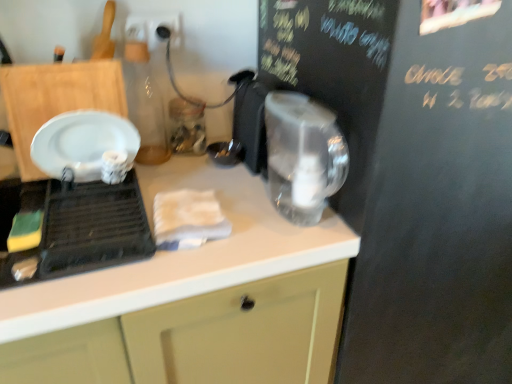
Find the location of a particular element. vacant space that is to the left of transparent plastic kettle at center is located at coordinates (231, 222).